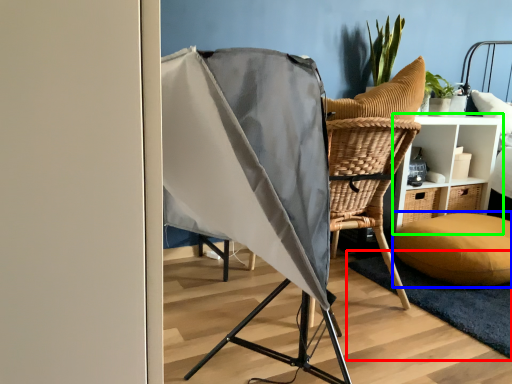
Question: Which is farther away from mat (highlighted by a red box)? pillow (highlighted by a blue box) or furniture (highlighted by a green box)?

Choices:
 (A) pillow
 (B) furniture

Answer: (B)